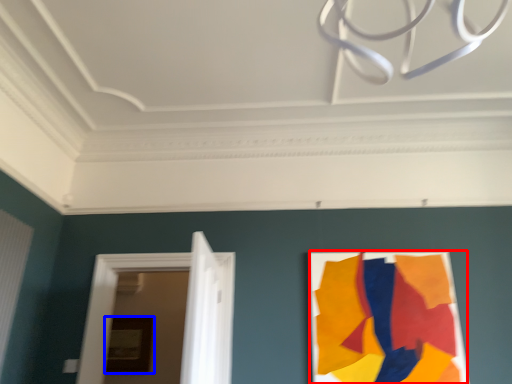
Question: Which of the following is the farthest to the observer, poster (highlighted by a red box) or picture frame (highlighted by a blue box)?

Choices:
 (A) poster
 (B) picture frame

Answer: (B)